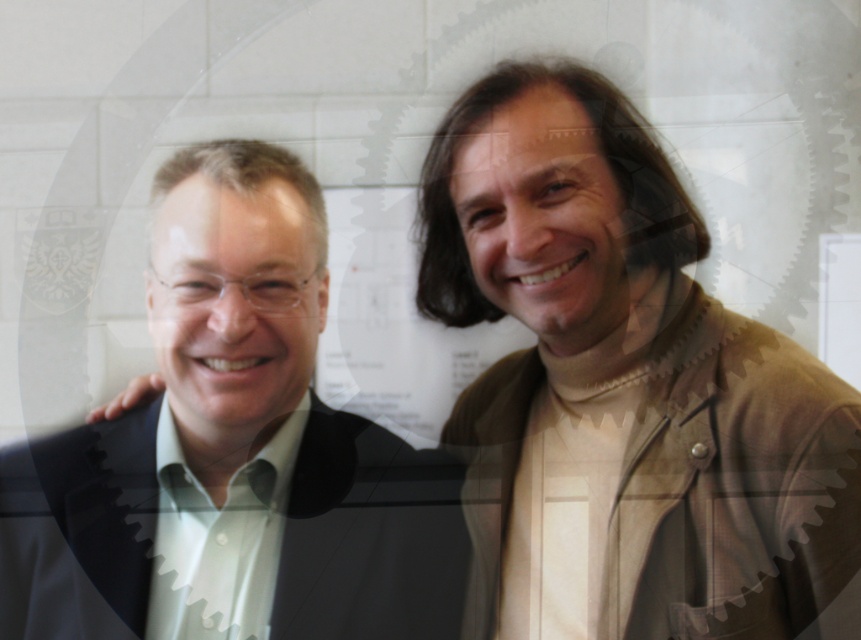
What do you see at coordinates (231, 452) in the screenshot? I see `matte black suit at left` at bounding box center [231, 452].

Find the location of a particular element. matte black suit at left is located at coordinates (231, 452).

Does point (31, 470) come farther from viewer compared to point (772, 438)?

That is True.

Locate an element on the screen. Image resolution: width=861 pixels, height=640 pixels. matte black suit at left is located at coordinates (231, 452).